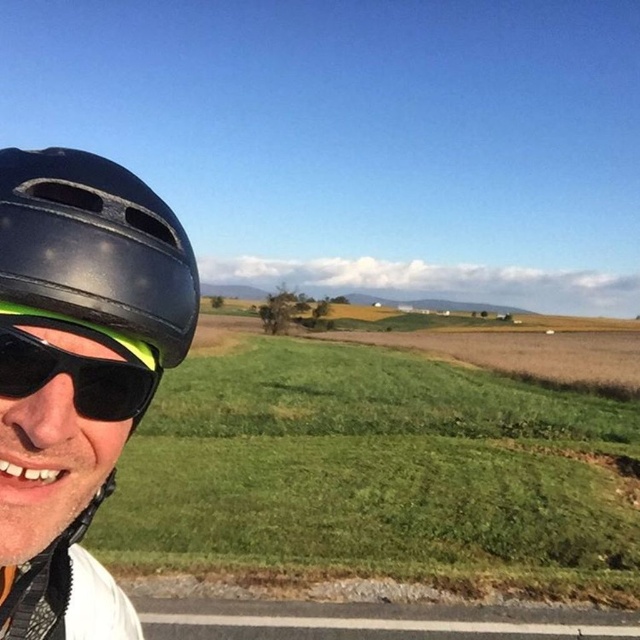
Question: Does matte black helmet at left appear on the left side of black matte sunglasses at left?

Choices:
 (A) no
 (B) yes

Answer: (B)

Question: Which of the following is the farthest from the observer?

Choices:
 (A) (104, 193)
 (B) (26, 387)

Answer: (A)

Question: Does black matte helmet at left appear under matte black helmet at left?

Choices:
 (A) no
 (B) yes

Answer: (B)

Question: Is black matte helmet at left bigger than matte black helmet at left?

Choices:
 (A) yes
 (B) no

Answer: (A)

Question: Estimate the real-world distances between objects in this image. Which object is closer to the black matte sunglasses at left?

Choices:
 (A) matte black helmet at left
 (B) black matte helmet at left

Answer: (A)

Question: Which object is the closest to the black matte sunglasses at left?

Choices:
 (A) matte black helmet at left
 (B) black matte helmet at left

Answer: (A)